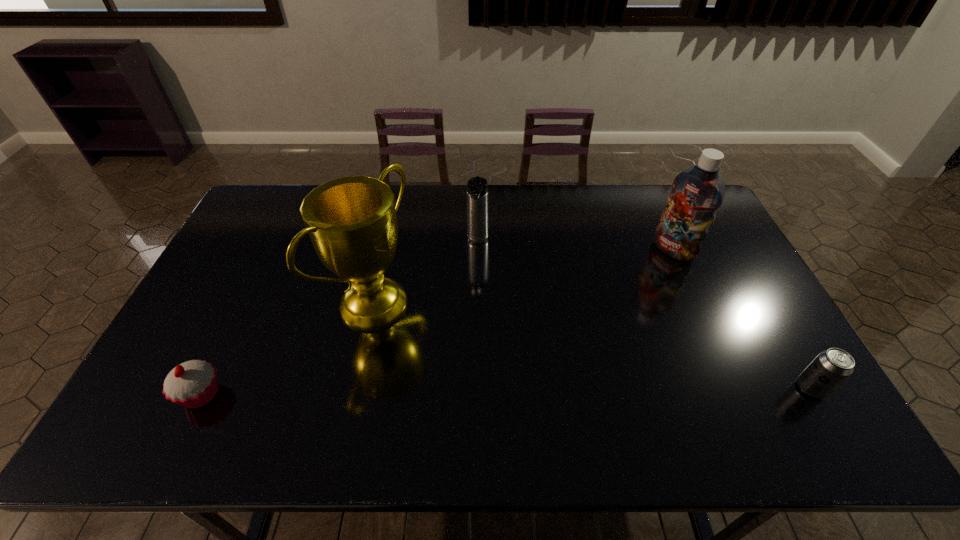
Image resolution: width=960 pixels, height=540 pixels. I want to click on the leftmost object, so click(x=192, y=384).

At what (x,y) coordinates should I click in order to perform the action: click on beer can. Please return your answer as a coordinate pair (x, y). Image resolution: width=960 pixels, height=540 pixels. Looking at the image, I should click on (831, 367).

In order to click on the second object from right to left in this screenshot , I will do `click(697, 192)`.

Locate an element on the screen. This screenshot has width=960, height=540. the third object from right to left is located at coordinates (477, 187).

Locate an element on the screen. This screenshot has width=960, height=540. thermos bottle is located at coordinates (477, 187).

Image resolution: width=960 pixels, height=540 pixels. What are the coordinates of `award` in the screenshot? It's located at (x=352, y=223).

Image resolution: width=960 pixels, height=540 pixels. I want to click on free location located on the right of the cupcake, so click(290, 394).

Where is `vacant space located 0.330m on the back of the rightmost object`? vacant space located 0.330m on the back of the rightmost object is located at coordinates (749, 281).

Find the location of a particular element. Image resolution: width=960 pixels, height=540 pixels. vacant space located on the front label of the fourth object from left to right is located at coordinates (624, 290).

Where is `free point located 0.200m on the front label of the fourth object from left to right`? free point located 0.200m on the front label of the fourth object from left to right is located at coordinates (627, 288).